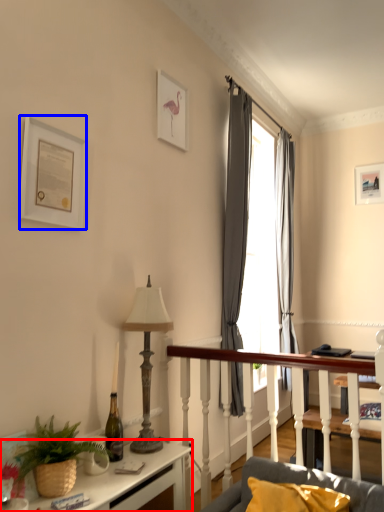
Question: Which point is further to the camera, desk (highlighted by a red box) or picture frame (highlighted by a blue box)?

Choices:
 (A) desk
 (B) picture frame

Answer: (B)